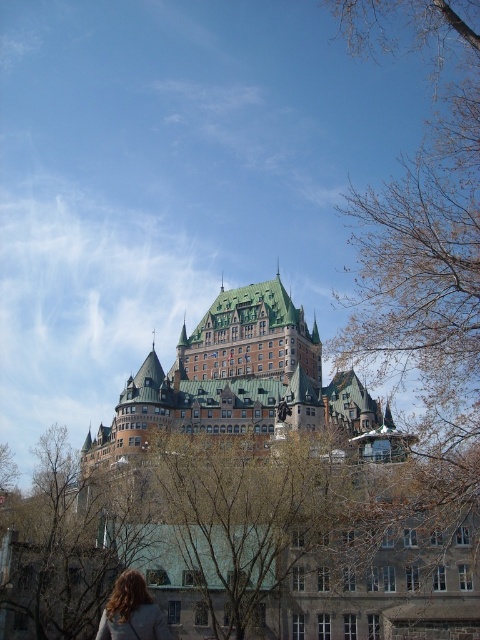
Between green leafy tree at center and blonde hair at lower left, which one appears on the right side from the viewer's perspective?

green leafy tree at center is more to the right.

This screenshot has width=480, height=640. In order to click on green leafy tree at center in this screenshot , I will do `click(247, 513)`.

Is point (239, 611) less distant than point (121, 632)?

No.

Image resolution: width=480 pixels, height=640 pixels. I want to click on green leafy tree at center, so click(x=247, y=513).

Can you confirm if bare branches at upper right is positioned above blonde hair at lower left?

Indeed, bare branches at upper right is positioned over blonde hair at lower left.

Which of these two, bare branches at upper right or blonde hair at lower left, stands taller?

Standing taller between the two is bare branches at upper right.

Which is behind, point (382, 211) or point (134, 579)?

Positioned behind is point (382, 211).

Locate an element on the screen. bare branches at upper right is located at coordinates pyautogui.click(x=425, y=250).

Does bare branches at upper right have a greater height compared to green leafy tree at center?

Indeed, bare branches at upper right has a greater height compared to green leafy tree at center.

Does bare branches at upper right have a larger size compared to green leafy tree at center?

Correct, bare branches at upper right is larger in size than green leafy tree at center.

Identify the location of bare branches at upper right. (425, 250).

This screenshot has width=480, height=640. Identify the location of bare branches at upper right. (425, 250).